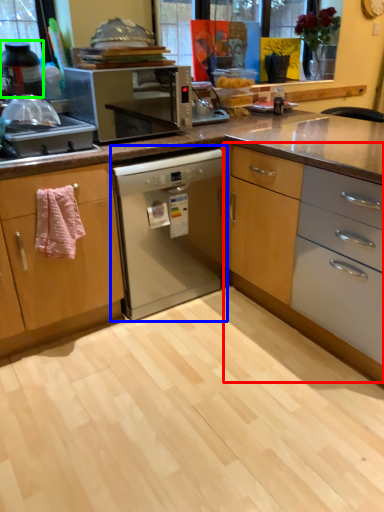
Question: Which is nearer to the cabinetry (highlighted by a red box)? home appliance (highlighted by a blue box) or kitchen appliance (highlighted by a green box).

Choices:
 (A) home appliance
 (B) kitchen appliance

Answer: (A)